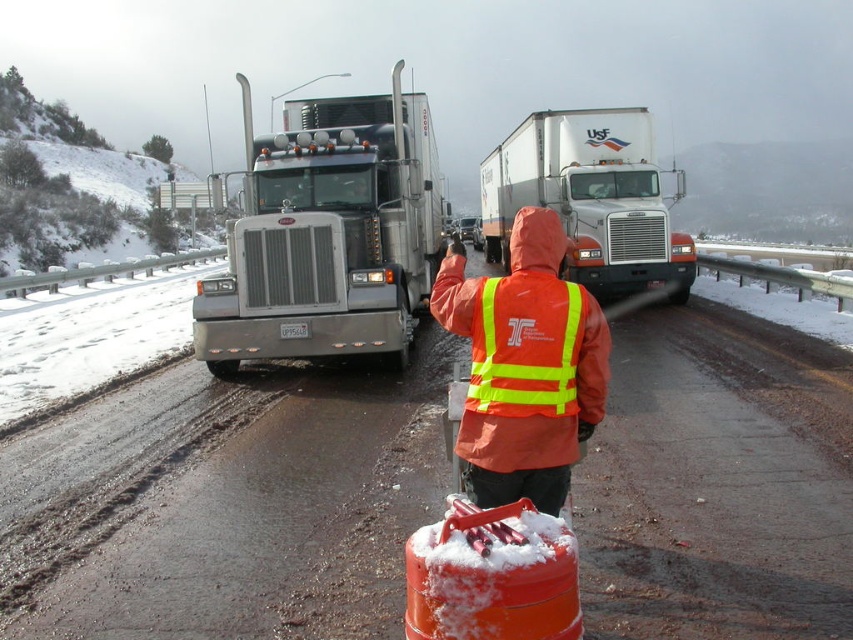
Question: Does silver metallic truck at center appear over orange reflective safety vest at center?

Choices:
 (A) yes
 (B) no

Answer: (A)

Question: Which object appears closest to the camera in this image?

Choices:
 (A) orange reflective jacket at center
 (B) orange reflective safety vest at center
 (C) white glossy truck at upper center

Answer: (B)

Question: Which object is closer to the camera taking this photo?

Choices:
 (A) orange reflective vest at center
 (B) orange reflective jacket at center
 (C) orange reflective safety vest at center

Answer: (C)

Question: Among these points, which one is nearest to the camera?

Choices:
 (A) (550, 285)
 (B) (520, 150)
 (C) (567, 401)
 (D) (380, 572)

Answer: (C)

Question: Observing the image, what is the correct spatial positioning of orange reflective vest at center in reference to silver metallic truck at center?

Choices:
 (A) above
 (B) below

Answer: (B)

Question: Does orange reflective vest at center appear over white glossy truck at upper center?

Choices:
 (A) yes
 (B) no

Answer: (B)